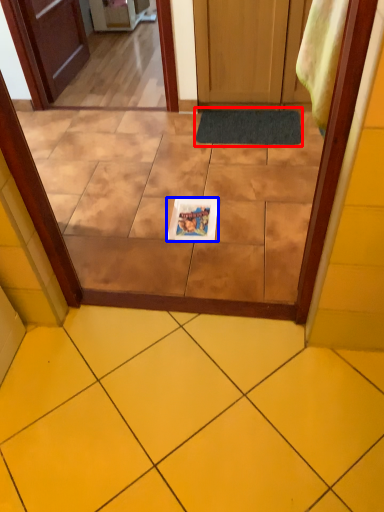
Question: Which object is further to the camera taking this photo, doormat (highlighted by a red box) or magazine (highlighted by a blue box)?

Choices:
 (A) doormat
 (B) magazine

Answer: (A)